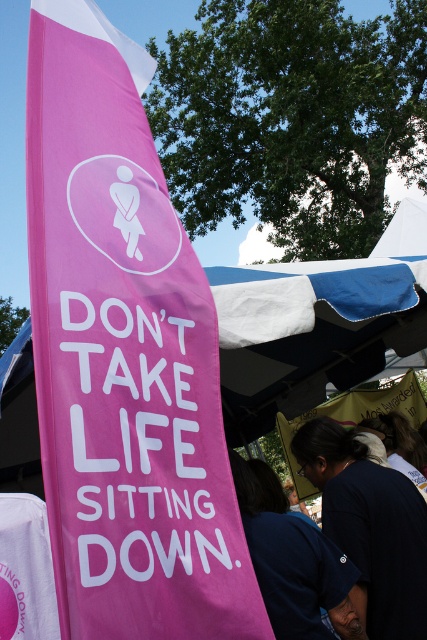
Question: Which object is the closest to the pink fabric banner at left?

Choices:
 (A) dark blue fabric at lower center
 (B) dark blue shirt at center

Answer: (B)

Question: Which point is closer to the camera taking this photo?

Choices:
 (A) (269, 556)
 (B) (192, 276)

Answer: (B)

Question: Can you confirm if pink fabric banner at left is positioned below dark blue fabric at lower center?

Choices:
 (A) no
 (B) yes

Answer: (A)

Question: Is pink fabric banner at left closer to the viewer compared to dark blue shirt at center?

Choices:
 (A) no
 (B) yes

Answer: (B)

Question: Can you confirm if pink fabric banner at left is wider than dark blue shirt at center?

Choices:
 (A) no
 (B) yes

Answer: (B)

Question: Which is farther from the dark blue shirt at center?

Choices:
 (A) dark blue fabric at lower center
 (B) pink fabric banner at left

Answer: (B)